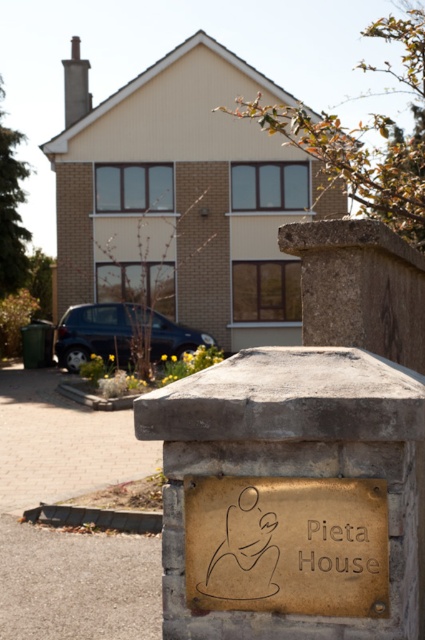
Question: Is gold textured plaque at center thinner than gold embossed sign at center?

Choices:
 (A) yes
 (B) no

Answer: (B)

Question: Which point is closer to the camera taking this photo?

Choices:
 (A) (371, 544)
 (B) (297, 528)

Answer: (A)

Question: Which point is closer to the camera?

Choices:
 (A) (368, 534)
 (B) (206, 544)

Answer: (A)

Question: Can you confirm if gold textured plaque at center is bigger than gold embossed sign at center?

Choices:
 (A) no
 (B) yes

Answer: (B)

Question: Which of the following is the closest to the observer?

Choices:
 (A) gold textured plaque at center
 (B) gold embossed sign at center

Answer: (A)

Question: In this image, where is gold textured plaque at center located relative to gold embossed sign at center?

Choices:
 (A) left
 (B) right

Answer: (A)